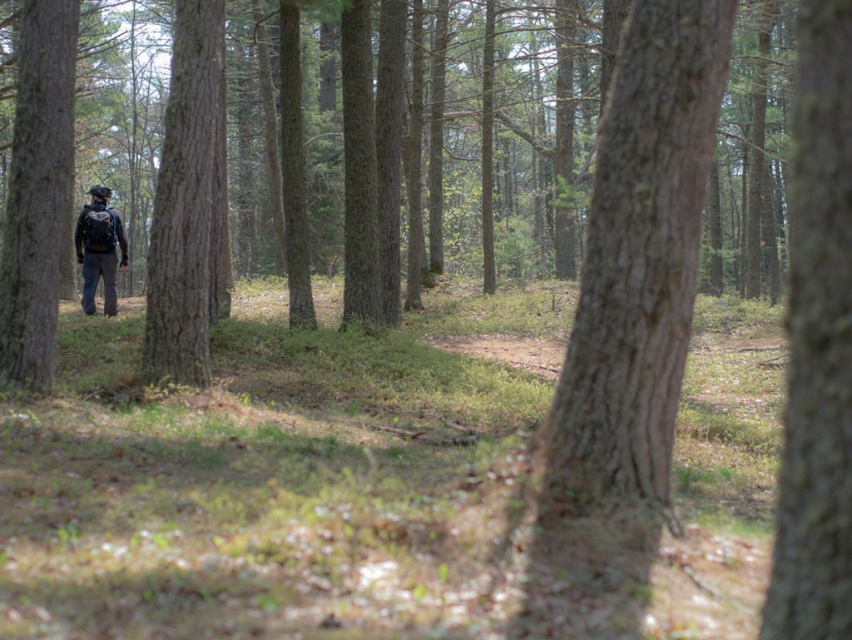
Question: In this image, where is smooth bark tree at right located relative to dark blue backpack at center?

Choices:
 (A) below
 (B) above

Answer: (B)

Question: Does smooth bark tree at left come in front of dark blue backpack at center?

Choices:
 (A) yes
 (B) no

Answer: (A)

Question: Which object is the farthest from the smooth bark tree at left?

Choices:
 (A) rough bark tree at left
 (B) smooth bark tree at right
 (C) smooth brown bark at center
 (D) dark blue backpack at center

Answer: (D)

Question: Estimate the real-world distances between objects in this image. Which object is closer to the rough bark tree at left?

Choices:
 (A) smooth bark tree at right
 (B) smooth bark tree at left
 (C) dark blue backpack at center
 (D) smooth brown bark at center

Answer: (B)

Question: Is smooth brown bark at center behind smooth bark tree at left?

Choices:
 (A) yes
 (B) no

Answer: (B)

Question: Which object is positioned farthest from the smooth bark tree at right?

Choices:
 (A) rough bark tree at left
 (B) smooth bark tree at left

Answer: (A)